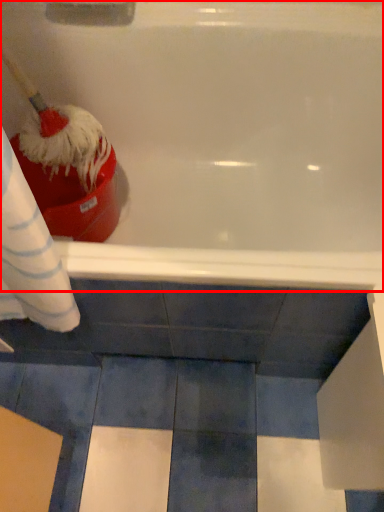
Question: Observing the image, what is the correct spatial positioning of bathtub (annotated by the red box) in reference to brush?

Choices:
 (A) right
 (B) left

Answer: (A)